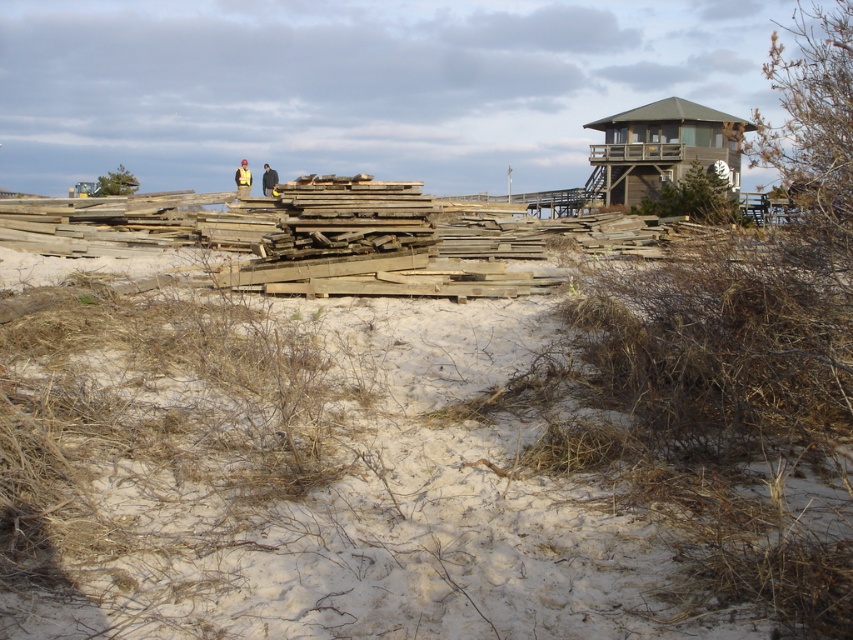
You are a safety inspector on the beach and need to ensure that the yellow hard hat at center and the yellow reflective vest at center are visible to workers. Since visibility is crucial, which object is shorter and might be less visible from a distance?

The yellow hard hat at center is shorter than the yellow reflective vest at center, so it might be less visible from a distance.